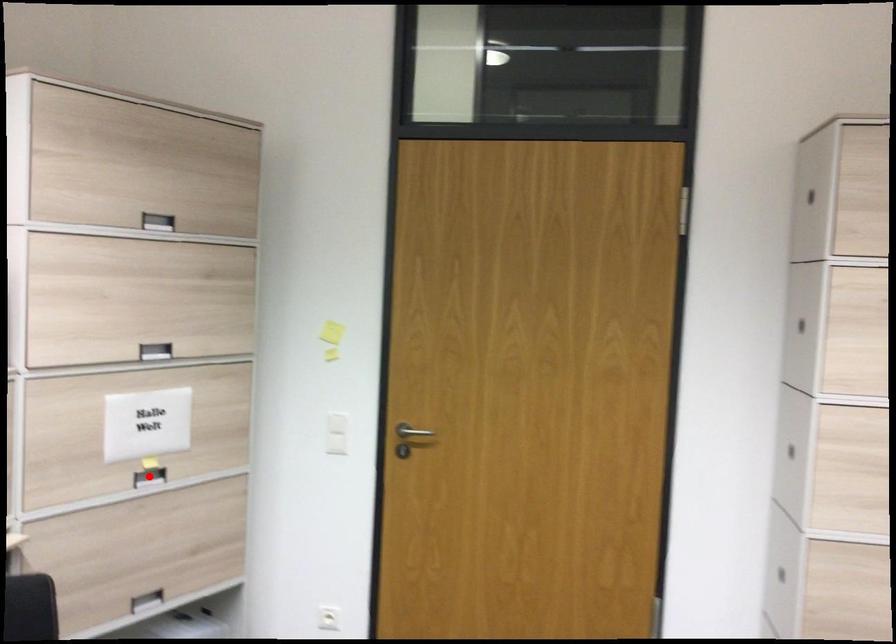
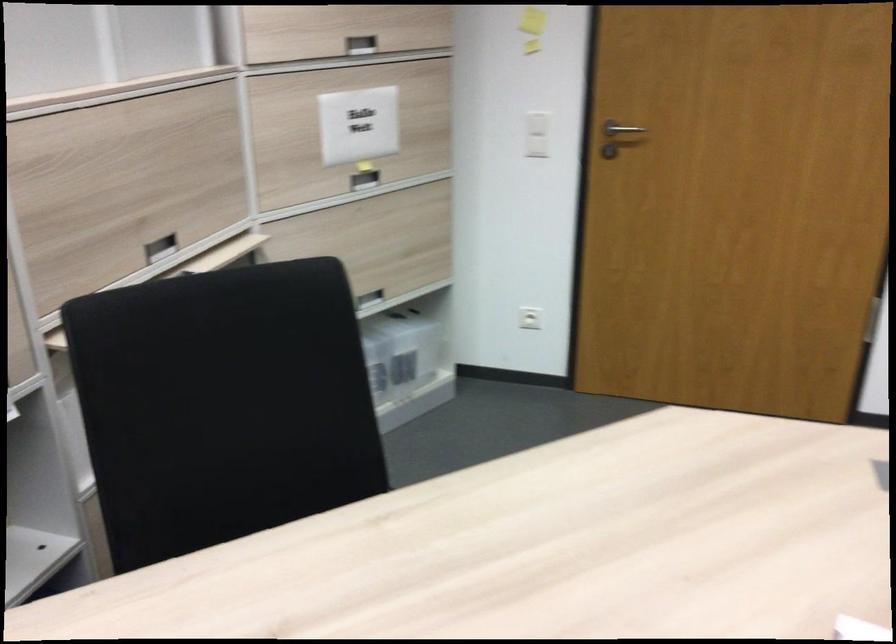
Where in the second image is the point corresponding to the highlighted location from the first image?

(364, 180)